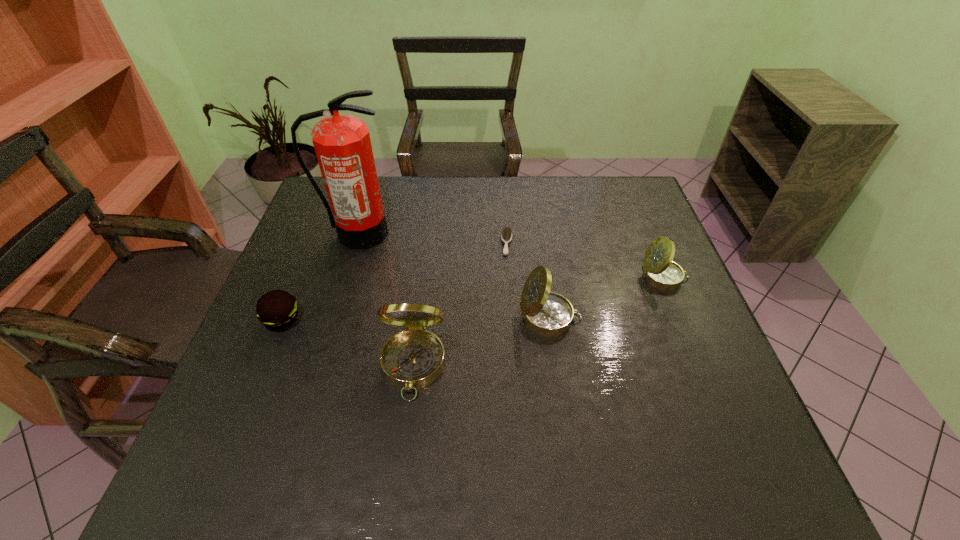
Locate an element on the screen. The image size is (960, 540). the third object from left to right is located at coordinates (412, 359).

Locate an element on the screen. The image size is (960, 540). the fourth shortest object is located at coordinates (545, 313).

The image size is (960, 540). What are the coordinates of `the second tallest compass` in the screenshot? It's located at (545, 313).

At what (x,y) coordinates should I click in order to perform the action: click on the rightmost object. Please return your answer as a coordinate pair (x, y). This screenshot has width=960, height=540. Looking at the image, I should click on (659, 271).

At what (x,y) coordinates should I click in order to perform the action: click on the rightmost compass. Please return your answer as a coordinate pair (x, y). Looking at the image, I should click on (659, 271).

Identify the location of the shortest object. The width and height of the screenshot is (960, 540). (506, 236).

The image size is (960, 540). Identify the location of scrubbing brush. (506, 236).

Where is `fire extinguisher`? The height and width of the screenshot is (540, 960). fire extinguisher is located at coordinates (342, 144).

The width and height of the screenshot is (960, 540). In order to click on the second shortest object in this screenshot , I will do `click(277, 309)`.

Find the location of `free space located 0.210m with the dial facing the second compass from right to left`. free space located 0.210m with the dial facing the second compass from right to left is located at coordinates (668, 318).